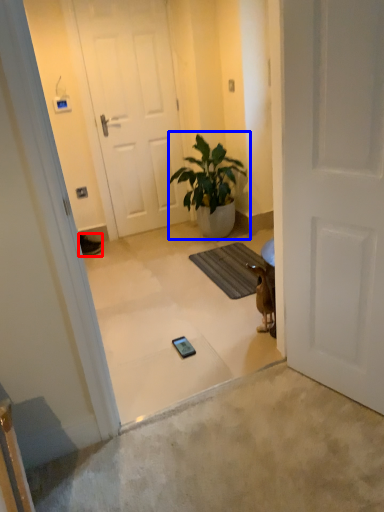
Question: Among these objects, which one is nearest to the camera, sneakers (highlighted by a red box) or houseplant (highlighted by a blue box)?

Choices:
 (A) sneakers
 (B) houseplant

Answer: (B)